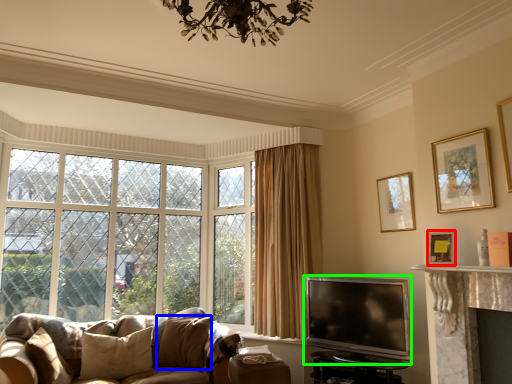
Question: Which is farther away from picture frame (highlighted by a red box)? pillow (highlighted by a blue box) or television (highlighted by a green box)?

Choices:
 (A) pillow
 (B) television

Answer: (A)